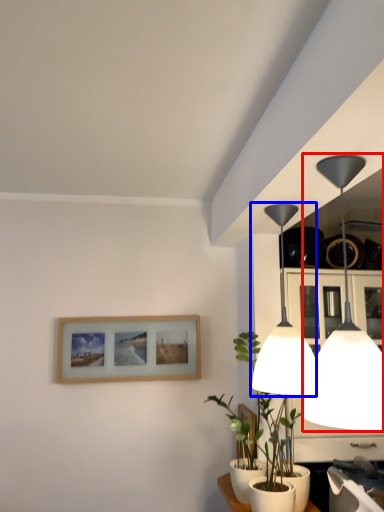
Question: Which object appears farthest to the camera in this image, lamp (highlighted by a red box) or lamp (highlighted by a blue box)?

Choices:
 (A) lamp
 (B) lamp

Answer: (B)